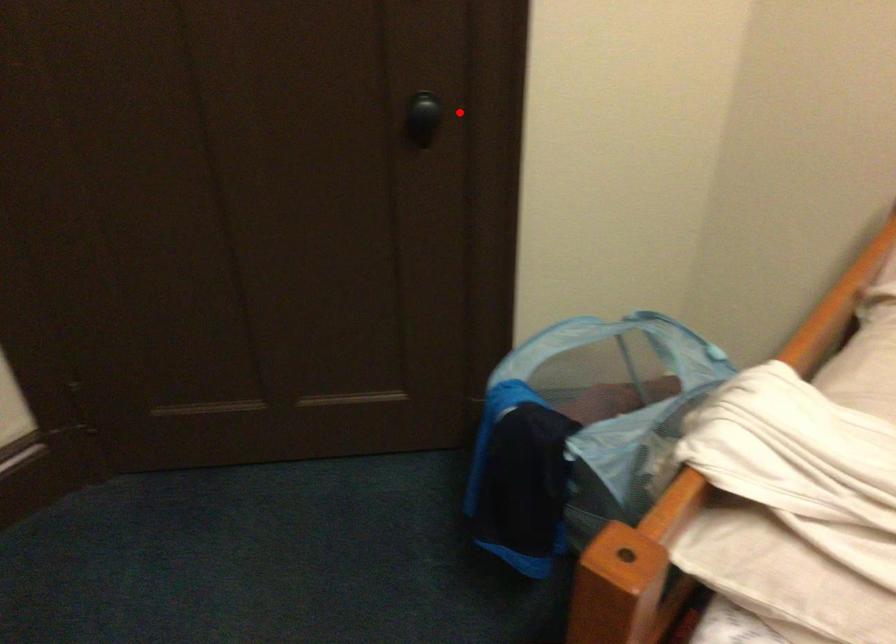
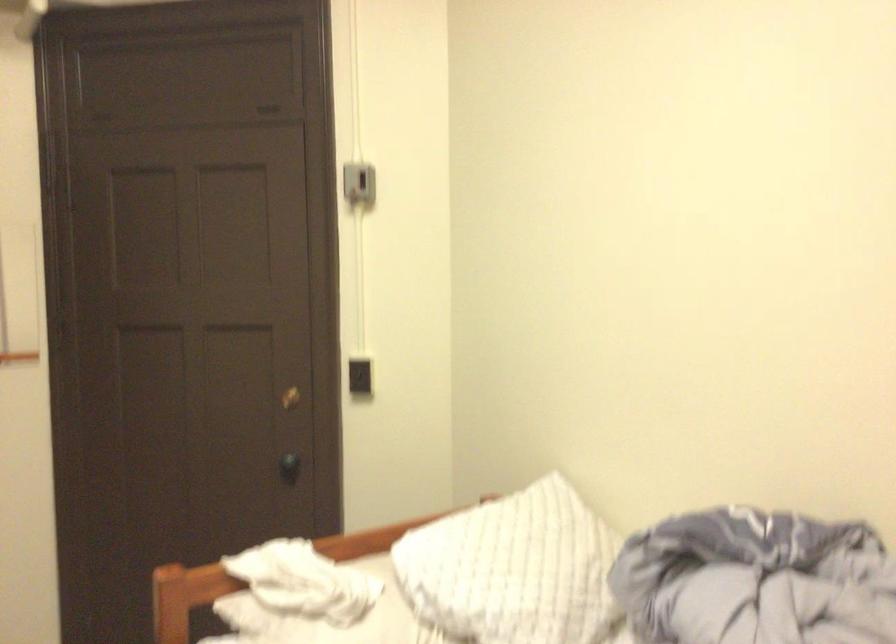
Question: I am providing you with two images of the same scene from different viewpoints. Image1 has a red point marked. In image2, the corresponding 3D location appears at what relative position? Reply with the corresponding letter.

Choices:
 (A) Closer
 (B) Farther

Answer: (B)